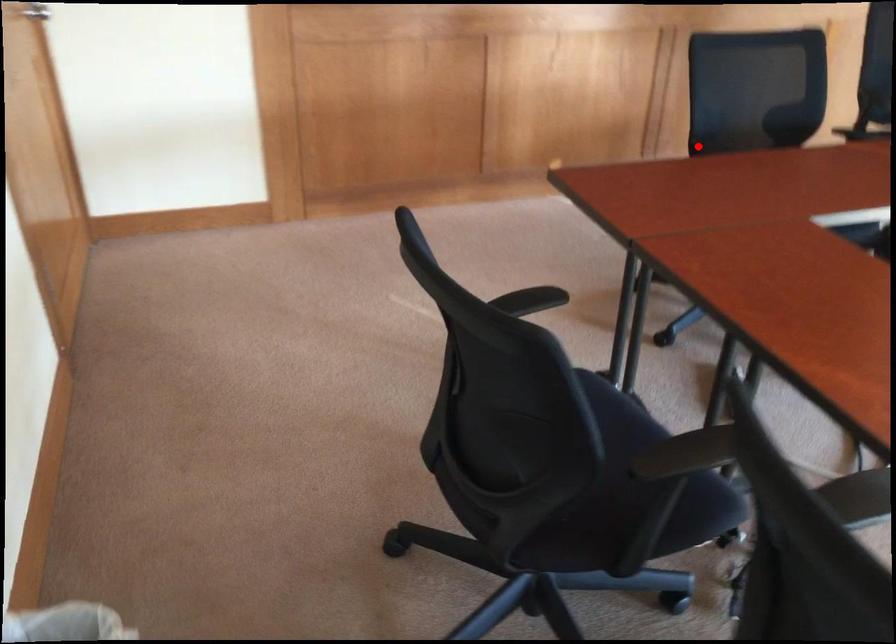
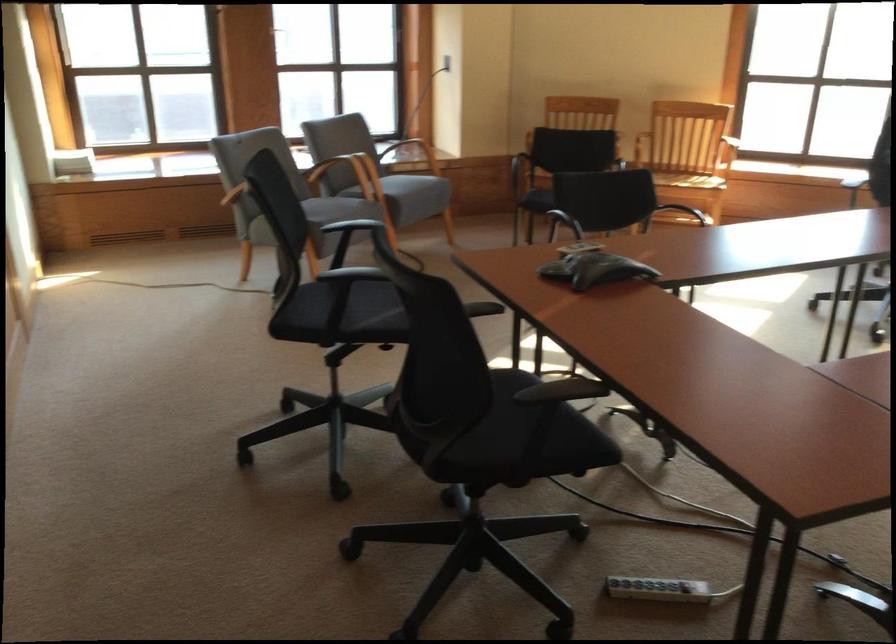
Where in the second image is the point corresponding to the highlighted location from the first image?

(561, 391)